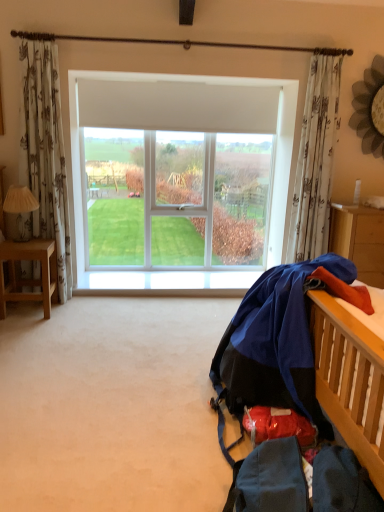
The height and width of the screenshot is (512, 384). Describe the element at coordinates (20, 210) in the screenshot. I see `white fabric lampshade at left` at that location.

The image size is (384, 512). What do you see at coordinates (359, 240) in the screenshot?
I see `orange fabric at right` at bounding box center [359, 240].

In order to click on blue fabric at right in this screenshot , I will do `click(276, 343)`.

Image resolution: width=384 pixels, height=512 pixels. What do you see at coordinates (187, 82) in the screenshot?
I see `white plastic window at center` at bounding box center [187, 82].

Locate an element on the screen. This screenshot has height=512, width=384. white fabric lampshade at left is located at coordinates (20, 210).

Is blue fabric at right far away from orange fabric at right?

Yes, blue fabric at right and orange fabric at right are located far from each other.

Considering the relative sizes of blue fabric at right and orange fabric at right in the image provided, is blue fabric at right taller than orange fabric at right?

No, blue fabric at right is not taller than orange fabric at right.

From a real-world perspective, between blue fabric at right and orange fabric at right, who is vertically higher?

orange fabric at right.

Which object is further away from the camera, blue fabric at right or orange fabric at right?

Positioned behind is orange fabric at right.

Locate an element on the screen. The height and width of the screenshot is (512, 384). window directly beneath the white floral fabric curtain at upper right (from a real-world perspective) is located at coordinates (187, 82).

From the picture: Considering the sizes of white floral fabric curtain at upper right and white plastic window at center in the image, is white floral fabric curtain at upper right wider or thinner than white plastic window at center?

In the image, white floral fabric curtain at upper right appears to be more narrow than white plastic window at center.

Does point (325, 105) lie behind point (79, 255)?

No, it is not.

In the scene shown: From a real-world perspective, which object stands above the other?

From a 3D spatial view, white floral fabric curtain at upper right is above.

Does orange fabric at right touch white floral fabric curtain at upper right?

No, orange fabric at right is not making contact with white floral fabric curtain at upper right.

Could you tell me if orange fabric at right is turned towards white floral fabric curtain at upper right?

No.

I want to click on curtain located on the left of orange fabric at right, so click(315, 161).

Can you confirm if white fabric lampshade at left is positioned to the right of white plastic window at center?

No, white fabric lampshade at left is not to the right of white plastic window at center.

Would you say white fabric lampshade at left contains white plastic window at center?

No, white plastic window at center is located outside of white fabric lampshade at left.

Could you tell me if white fabric lampshade at left is turned towards white plastic window at center?

No.

Considering the positions of points (15, 196) and (72, 150), is point (15, 196) closer to camera compared to point (72, 150)?

That is True.

Looking at their sizes, would you say orange fabric at right is wider or thinner than white fabric lampshade at left?

orange fabric at right is wider than white fabric lampshade at left.

Is orange fabric at right in front of white fabric lampshade at left?

No, orange fabric at right is further to the viewer.

Is orange fabric at right touching white fabric lampshade at left?

No, orange fabric at right is not making contact with white fabric lampshade at left.

Based on the photo, between orange fabric at right and white fabric lampshade at left, which one has less height?

With less height is white fabric lampshade at left.

Is white fabric lampshade at left outside of light brown wooden desk at left?

Yes, white fabric lampshade at left is located beyond the bounds of light brown wooden desk at left.

Can you tell me how much white fabric lampshade at left and light brown wooden desk at left differ in facing direction?

The angular difference between white fabric lampshade at left and light brown wooden desk at left is 2.49 degrees.

Considering the relative sizes of white fabric lampshade at left and light brown wooden desk at left in the image provided, is white fabric lampshade at left shorter than light brown wooden desk at left?

Correct, white fabric lampshade at left is not as tall as light brown wooden desk at left.

Is white fabric lampshade at left far away from light brown wooden desk at left?

Actually, white fabric lampshade at left and light brown wooden desk at left are a little close together.

Considering the positions of objects white plastic window at center and light brown wooden desk at left in the image provided, who is in front, white plastic window at center or light brown wooden desk at left?

Positioned in front is light brown wooden desk at left.

Does point (69, 72) come behind point (3, 318)?

Yes, it is behind point (3, 318).

How different are the orientations of white plastic window at center and light brown wooden desk at left in degrees?

There is a 0.979-degree angle between the facing directions of white plastic window at center and light brown wooden desk at left.

Do you think white plastic window at center is within light brown wooden desk at left, or outside of it?

white plastic window at center cannot be found inside light brown wooden desk at left.

The height and width of the screenshot is (512, 384). I want to click on clothing in front of the orange fabric at right, so click(x=276, y=343).

You are a GUI agent. You are given a task and a screenshot of the screen. Output one action in this format:
    pyautogui.click(x=<x>, y=<y>)
    Task: Click on the curtain on the right of the white plastic window at center
    The height and width of the screenshot is (512, 384).
    Given the screenshot: What is the action you would take?
    pyautogui.click(x=315, y=161)

When comparing their distances from blue fabric at right, does white fabric lampshade at left or light brown wooden desk at left seem closer?

Based on the image, light brown wooden desk at left appears to be nearer to blue fabric at right.

Based on their spatial positions, is blue fabric at right or orange fabric at right further from white fabric lampshade at left?

Among the two, orange fabric at right is located further to white fabric lampshade at left.

From the image, which object appears to be farther from blue fabric at right, white plastic window at center or white fabric lampshade at left?

The object further to blue fabric at right is white fabric lampshade at left.

Which object lies nearer to the anchor point white floral fabric curtain at upper right, light brown wooden desk at left or white fabric lampshade at left?

light brown wooden desk at left is closer to white floral fabric curtain at upper right.

Based on their spatial positions, is white fabric lampshade at left or blue fabric at right closer to light brown wooden desk at left?

The object closer to light brown wooden desk at left is white fabric lampshade at left.

When comparing their distances from white floral fabric curtain at upper right, does light brown wooden desk at left or blue fabric at right seem further?

light brown wooden desk at left lies further to white floral fabric curtain at upper right than the other object.

Based on their spatial positions, is white fabric lampshade at left or white plastic window at center closer to blue fabric at right?

Based on the image, white plastic window at center appears to be nearer to blue fabric at right.

Considering their positions, is light brown wooden desk at left positioned further to white plastic window at center than blue fabric at right?

blue fabric at right is further to white plastic window at center.

You are a GUI agent. You are given a task and a screenshot of the screen. Output one action in this format:
    pyautogui.click(x=<x>, y=<y>)
    Task: Click on the nightstand between blue fabric at right and white plastic window at center along the z-axis
    This screenshot has width=384, height=512.
    Given the screenshot: What is the action you would take?
    pyautogui.click(x=359, y=240)

The width and height of the screenshot is (384, 512). I want to click on lamp between blue fabric at right and white plastic window at center in the front-back direction, so click(20, 210).

Where is `clothing located between light brown wooden desk at left and orange fabric at right in the left-right direction`? clothing located between light brown wooden desk at left and orange fabric at right in the left-right direction is located at coordinates (276, 343).

Where is `clothing located between white fabric lampshade at left and orange fabric at right in the left-right direction`? This screenshot has width=384, height=512. clothing located between white fabric lampshade at left and orange fabric at right in the left-right direction is located at coordinates (276, 343).